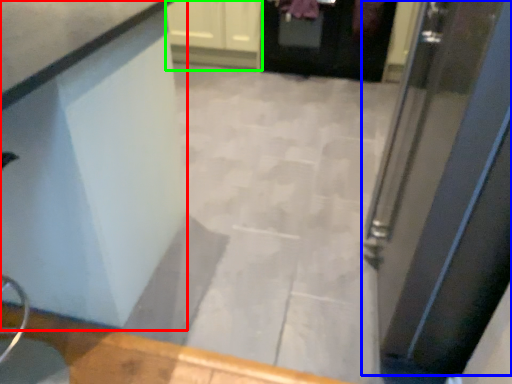
Question: Which is farther away from counter (highlighted by a red box)? door (highlighted by a blue box) or cabinetry (highlighted by a green box)?

Choices:
 (A) door
 (B) cabinetry

Answer: (B)